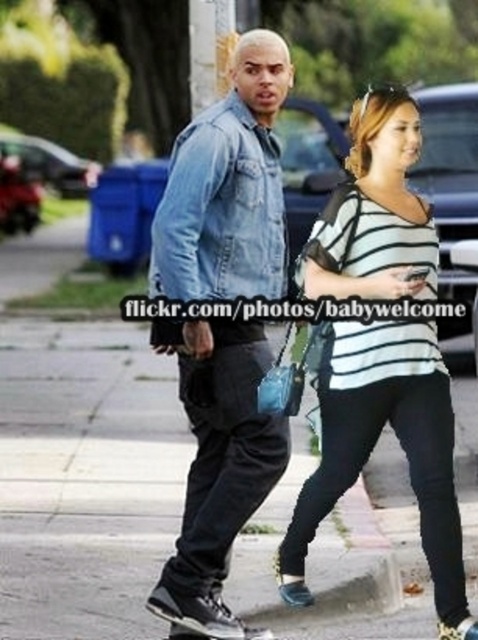
You are a photographer trying to capture a candid shot of both the denim jacket at center and the striped jersey at center. Since you want to ensure both are visible in the frame, which clothing item should you focus on to ensure the entire person is in the shot?

The denim jacket at center occupies less space than the striped jersey at center, so you should focus on the striped jersey at center to ensure the entire person is in the shot.